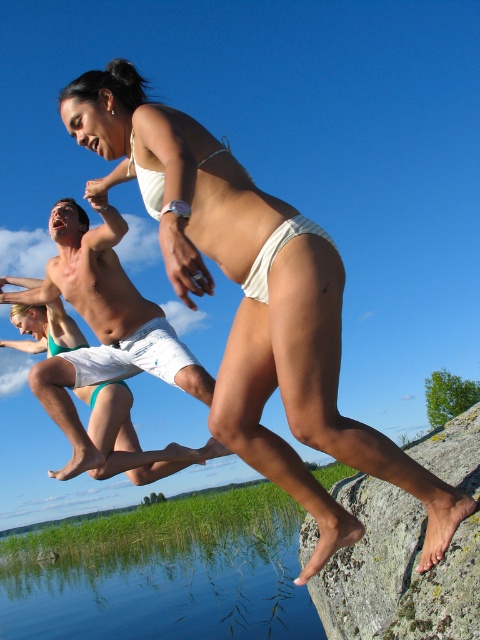
You are a photographer trying to capture the perfect shot of the white fabric bikini bottom at center and the transparent water at lower left. Which object is positioned lower in the image?

The transparent water at lower left is positioned below the white fabric bikini bottom at center, so it is lower in the image.

You are a photographer trying to capture the splash of the white matte bikini bottom at center and the transparent water at lower left. Which object will appear closer to the camera lens?

The white matte bikini bottom at center is in front of the transparent water at lower left, so it will appear closer to the camera lens.